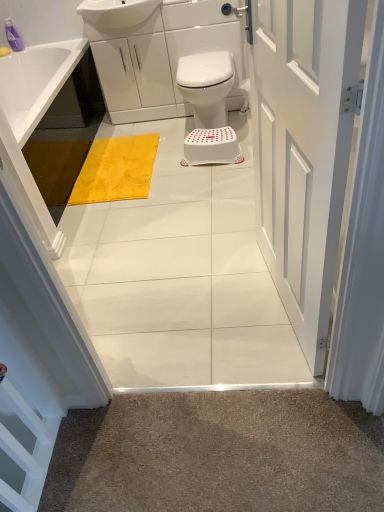
Where is `free spot to the right of translucent purple bottle at upper left`? free spot to the right of translucent purple bottle at upper left is located at coordinates (42, 46).